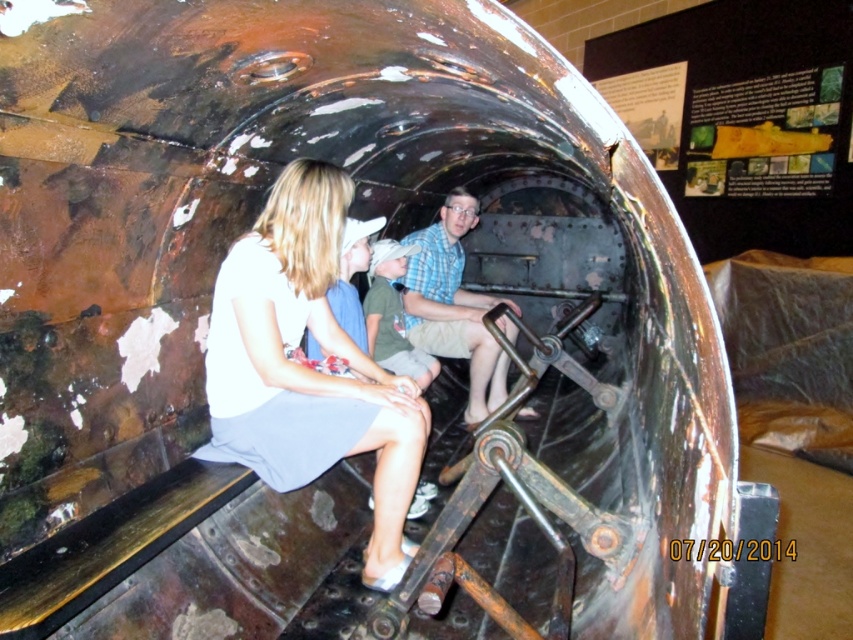
Does white fabric dress at center have a greater height compared to checkered fabric shirt at center?

Indeed, white fabric dress at center has a greater height compared to checkered fabric shirt at center.

In the scene shown: Measure the distance between white fabric dress at center and camera.

A distance of 6.48 feet exists between white fabric dress at center and camera.

Is point (317, 275) farther from viewer compared to point (408, 314)?

No.

I want to click on white fabric dress at center, so click(x=306, y=365).